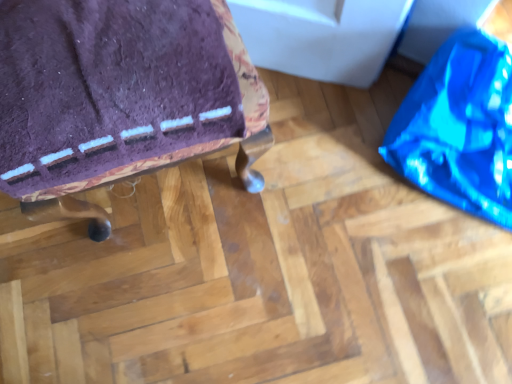
Where is `vacant space to the left of shiny blue bean bag at right`? vacant space to the left of shiny blue bean bag at right is located at coordinates (320, 159).